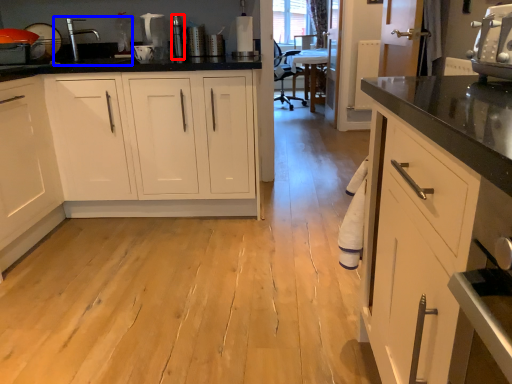
Question: Which object appears farthest to the camera in this image, appliance (highlighted by a red box) or sink (highlighted by a blue box)?

Choices:
 (A) appliance
 (B) sink

Answer: (A)